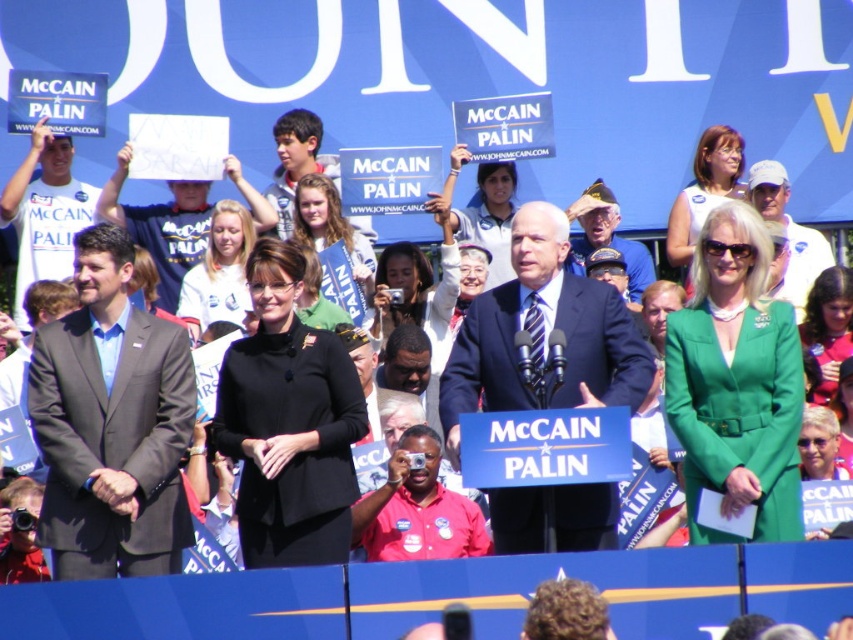
Question: Does dark gray suit at left have a smaller size compared to dark blue suit at center?

Choices:
 (A) no
 (B) yes

Answer: (B)

Question: From the image, what is the correct spatial relationship of dark gray suit at left in relation to dark blue suit at center?

Choices:
 (A) right
 (B) left

Answer: (B)

Question: Which object is the farthest from the dark blue suit at center?

Choices:
 (A) blue fabric banner at upper center
 (B) black matte suit at center
 (C) dark gray suit at left

Answer: (C)

Question: Which object appears closest to the camera in this image?

Choices:
 (A) dark gray suit at left
 (B) blue fabric banner at upper center
 (C) black matte suit at center
 (D) dark blue suit at center

Answer: (D)

Question: Considering the relative positions of dark gray suit at left and black matte suit at center in the image provided, where is dark gray suit at left located with respect to black matte suit at center?

Choices:
 (A) left
 (B) right

Answer: (A)

Question: Among these points, which one is nearest to the camera?

Choices:
 (A) (178, 401)
 (B) (457, 163)
 (C) (326, 556)

Answer: (C)